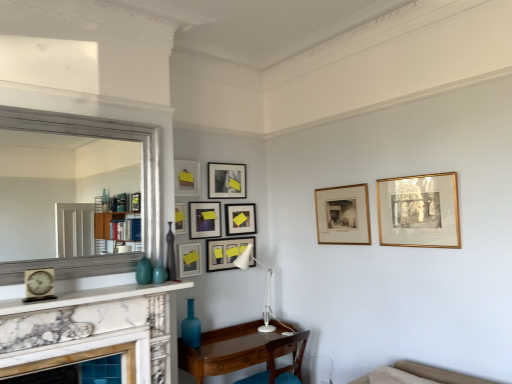
Question: From a real-world perspective, is wooden picture frame at center, acting as the eighth picture frame starting from the left, positioned above or below marble fireplace at lower left?

Choices:
 (A) above
 (B) below

Answer: (A)

Question: Would you say wooden picture frame at center, acting as the eighth picture frame starting from the left, is to the left or to the right of marble fireplace at lower left in the picture?

Choices:
 (A) left
 (B) right

Answer: (B)

Question: Which is nearer to the brown wooden table at lower center?

Choices:
 (A) matte black picture frame at upper center, the third picture frame when ordered from right to left
 (B) blue glass vase at lower center, arranged as the 2th vase when viewed from the front
 (C) matte gold picture frame at upper center, placed as the 8th picture frame when sorted from right to left
 (D) matte gold picture frame at center, the 3th picture frame viewed from the left
 (E) brown wooden chair at lower center

Answer: (E)

Question: Based on their relative distances, which object is nearer to the matte black picture frame at center, the 4th picture frame in the right-to-left sequence?

Choices:
 (A) matte blue glass vase at center, which ranks as the 1th vase in top-to-bottom order
 (B) matte glass vase at center, positioned as the first turquoise in left-to-right order
 (C) matte gold picture frame at center, arranged as the seventh picture frame when viewed from the right
 (D) white wall at center
 (E) matte black picture frame at upper center, the third picture frame when ordered from right to left

Answer: (E)